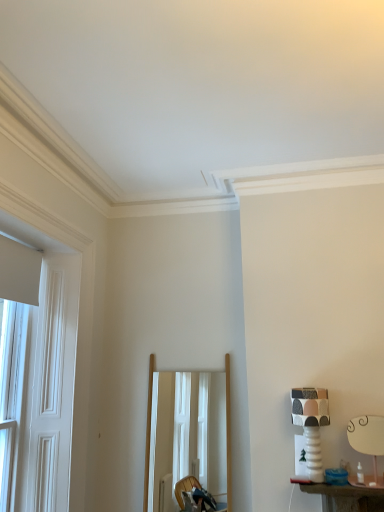
Question: From the image's perspective, is patterned ceramic table lamp at right, which ranks as the 1th table lamp in left-to-right order, above white wooden door at left?

Choices:
 (A) yes
 (B) no

Answer: (B)

Question: Is patterned ceramic table lamp at right, which ranks as the 1th table lamp in left-to-right order, further to camera compared to white wooden door at left?

Choices:
 (A) yes
 (B) no

Answer: (A)

Question: From the image's perspective, does patterned ceramic table lamp at right, which ranks as the 1th table lamp in left-to-right order, appear lower than white wooden door at left?

Choices:
 (A) yes
 (B) no

Answer: (A)

Question: Is patterned ceramic table lamp at right, which ranks as the 1th table lamp in left-to-right order, looking in the opposite direction of white wooden door at left?

Choices:
 (A) no
 (B) yes

Answer: (A)

Question: Does patterned ceramic table lamp at right, which is the 2th table lamp in right-to-left order, have a lesser width compared to white wooden door at left?

Choices:
 (A) no
 (B) yes

Answer: (A)

Question: Would you say white ceramic table lamp at right, the second table lamp viewed from the left, is to the left or to the right of white wooden door at left in the picture?

Choices:
 (A) right
 (B) left

Answer: (A)

Question: Considering the positions of white ceramic table lamp at right, the second table lamp viewed from the left, and white wooden door at left in the image, is white ceramic table lamp at right, the second table lamp viewed from the left, wider or thinner than white wooden door at left?

Choices:
 (A) thin
 (B) wide

Answer: (B)

Question: Relative to white wooden door at left, is white ceramic table lamp at right, the second table lamp viewed from the left, in front or behind?

Choices:
 (A) front
 (B) behind

Answer: (B)

Question: Would you say white ceramic table lamp at right, the second table lamp viewed from the left, is inside or outside white wooden door at left?

Choices:
 (A) outside
 (B) inside

Answer: (A)

Question: From a real-world perspective, is wooden frame mirror at center positioned above or below white ceramic table lamp at right, the second table lamp viewed from the left?

Choices:
 (A) below
 (B) above

Answer: (B)

Question: In the image, is wooden frame mirror at center on the left side or the right side of white ceramic table lamp at right, the second table lamp viewed from the left?

Choices:
 (A) left
 (B) right

Answer: (A)

Question: Looking at their shapes, would you say wooden frame mirror at center is wider or thinner than white ceramic table lamp at right, which is counted as the first table lamp, starting from the right?

Choices:
 (A) wide
 (B) thin

Answer: (A)

Question: Is wooden frame mirror at center taller or shorter than white ceramic table lamp at right, the second table lamp viewed from the left?

Choices:
 (A) short
 (B) tall

Answer: (B)

Question: Considering the relative positions of wooden frame mirror at center and white wooden door at left in the image provided, is wooden frame mirror at center to the left or to the right of white wooden door at left?

Choices:
 (A) right
 (B) left

Answer: (A)

Question: Is wooden frame mirror at center situated inside white wooden door at left or outside?

Choices:
 (A) outside
 (B) inside

Answer: (A)